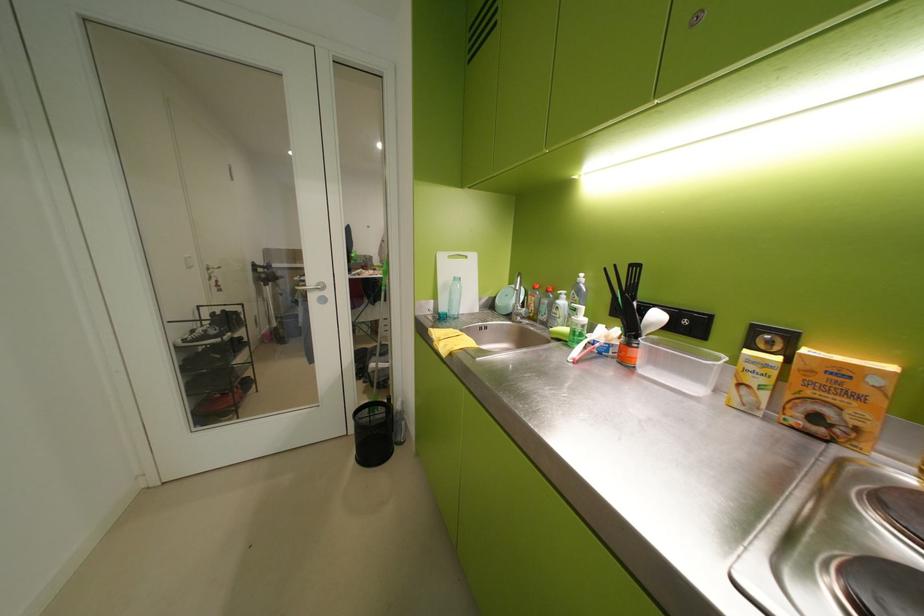
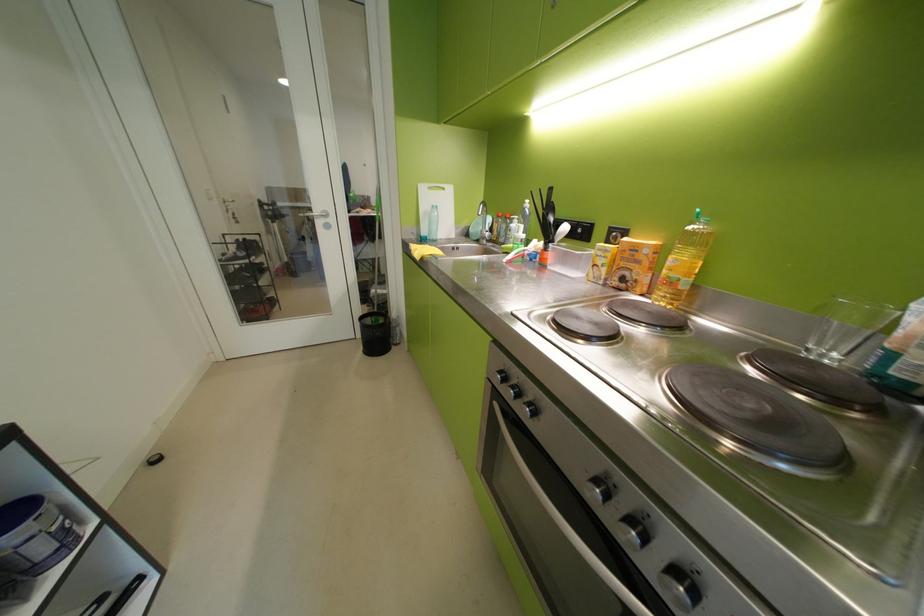
In the second image, find the point that corresponds to the point at 852,373 in the first image.

(646, 249)